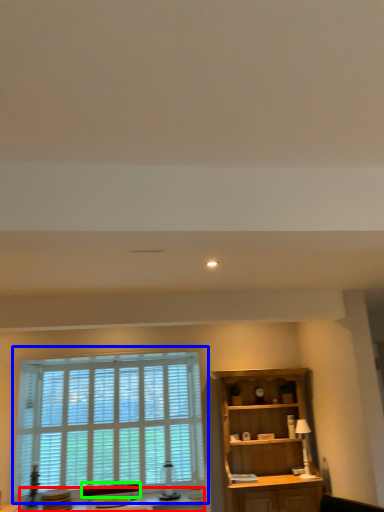
Question: Which object is positioned closest to table (highlighted by a red box)? Select from window (highlighted by a blue box) and swivel chair (highlighted by a green box).

Choices:
 (A) window
 (B) swivel chair

Answer: (B)